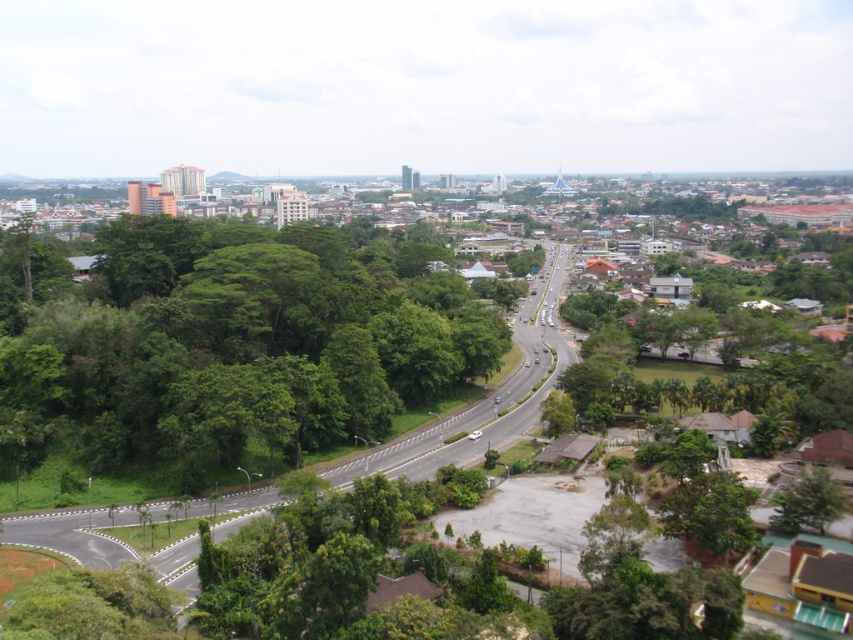
Question: Is green leafy highway at center smaller than green leafy tree at lower right?

Choices:
 (A) yes
 (B) no

Answer: (B)

Question: Which point is farther from the camera taking this photo?

Choices:
 (A) (190, 589)
 (B) (805, 515)

Answer: (B)

Question: Does green leafy highway at center appear on the right side of green leafy tree at lower right?

Choices:
 (A) no
 (B) yes

Answer: (A)

Question: Does green leafy highway at center appear under green leafy tree at lower right?

Choices:
 (A) no
 (B) yes

Answer: (A)